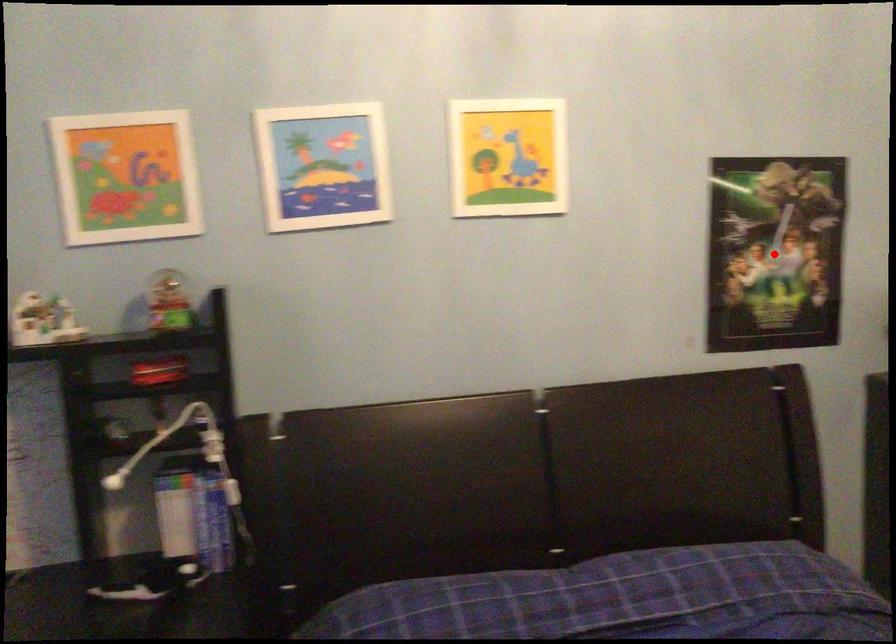
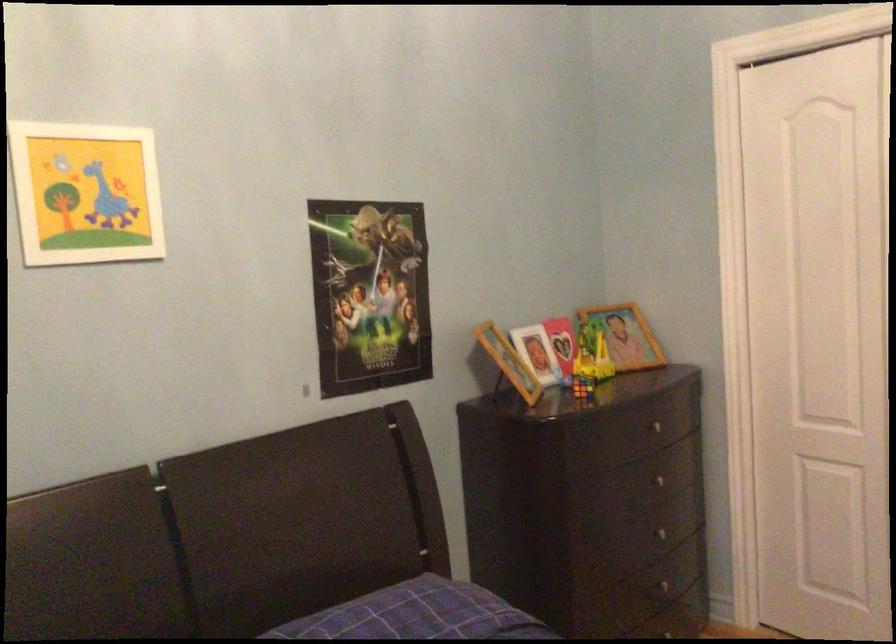
Where in the second image is the point corresponding to the highlighted location from the first image?

(369, 294)